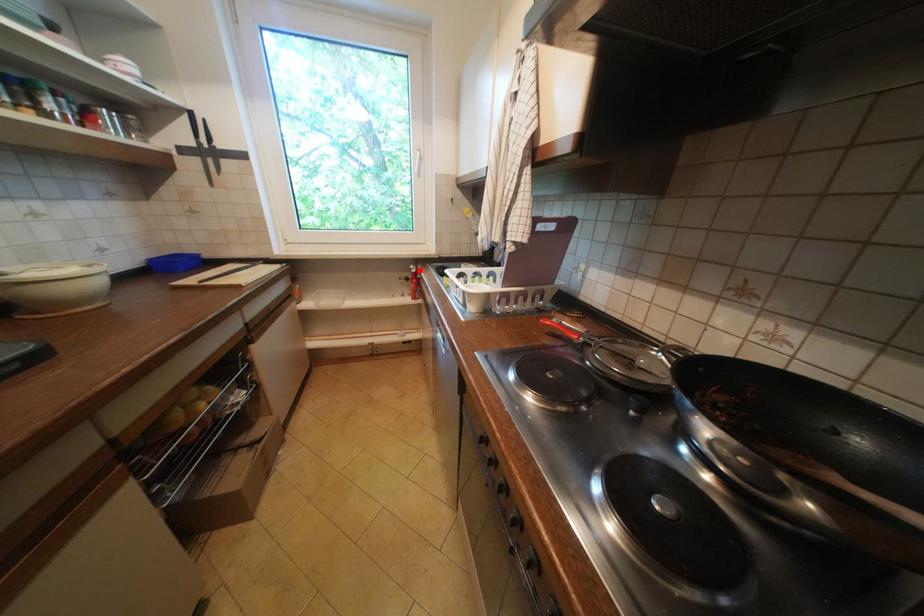
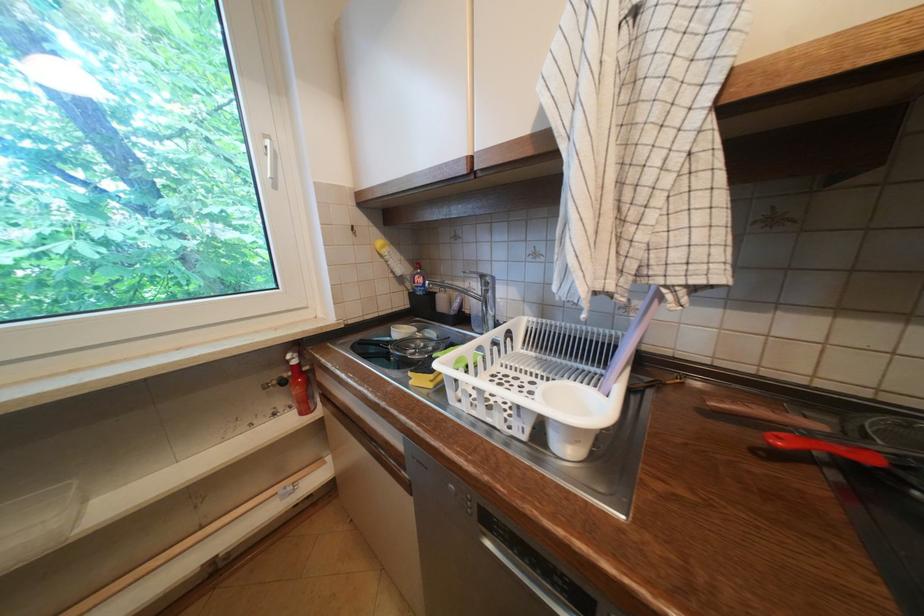
Find the pixel in the second image that matches the highlighted location in the first image.

(296, 362)